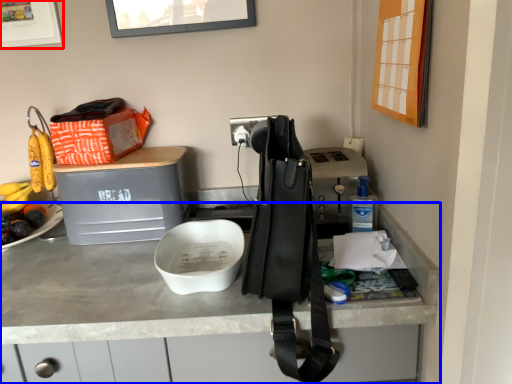
Question: Which object is closer to the camera taking this photo, picture frame (highlighted by a red box) or desk (highlighted by a blue box)?

Choices:
 (A) picture frame
 (B) desk

Answer: (B)